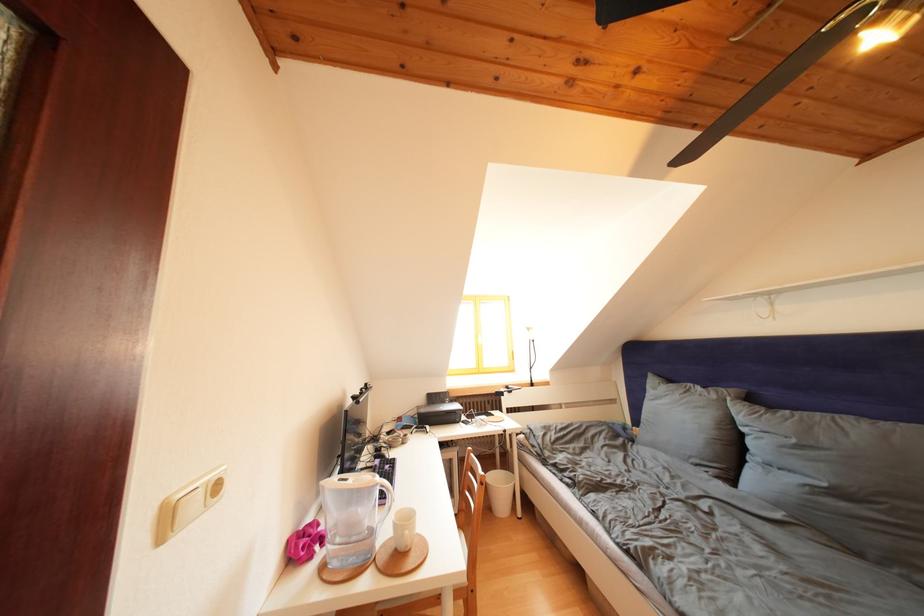
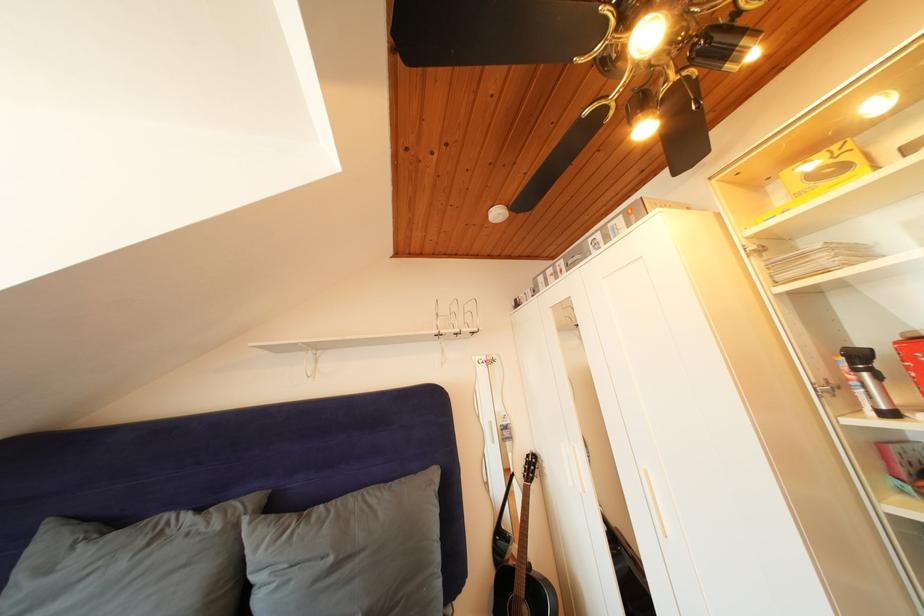
Locate, in the second image, the point that corresponds to [801,446] in the first image.

(338, 565)